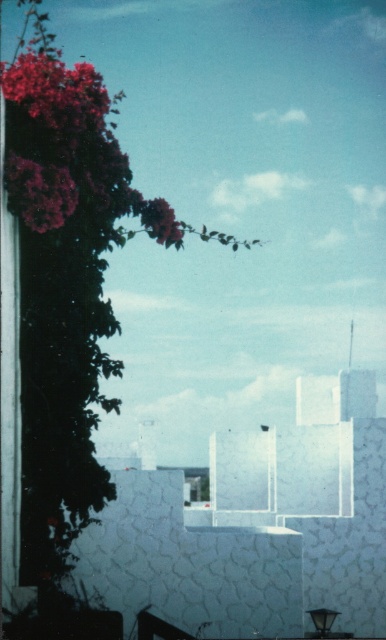
Is matte purple flower at upper left positioned in front of purple matte flower at upper left?

Yes, it is.

Is point (67, 172) in front of point (150, 211)?

That is True.

I want to click on matte purple flower at upper left, so click(x=38, y=193).

Is point (167, 214) positioned behind point (159, 209)?

No, it is in front of (159, 209).

Is point (89, 67) positioned in front of point (160, 218)?

Yes, point (89, 67) is closer to viewer.

At what (x,y) coordinates should I click in order to perform the action: click on vivid purple petals at upper left. Please return your answer as a coordinate pair (x, y). Looking at the image, I should click on (69, 148).

Is point (30, 96) positioned before point (55, 195)?

No, it is behind (55, 195).

Consider the image. Between vivid purple petals at upper left and matte purple flower at upper left, which one is positioned higher?

Positioned higher is vivid purple petals at upper left.

You are a GUI agent. You are given a task and a screenshot of the screen. Output one action in this format:
    pyautogui.click(x=<x>, y=<y>)
    Task: Click on the vivid purple petals at upper left
    The image size is (386, 640).
    Given the screenshot: What is the action you would take?
    pyautogui.click(x=69, y=148)

The width and height of the screenshot is (386, 640). Identify the location of vivid purple petals at upper left. 69,148.